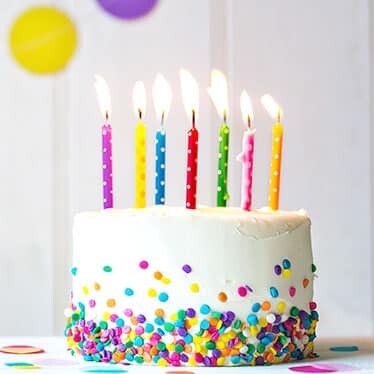
At what (x,y) coordinates should I click in order to perform the action: click on candles. Please return your answer as a coordinate pair (x, y). The width and height of the screenshot is (374, 374). Looking at the image, I should click on (278, 157), (247, 163), (226, 168), (192, 171), (160, 172), (142, 173), (110, 173).